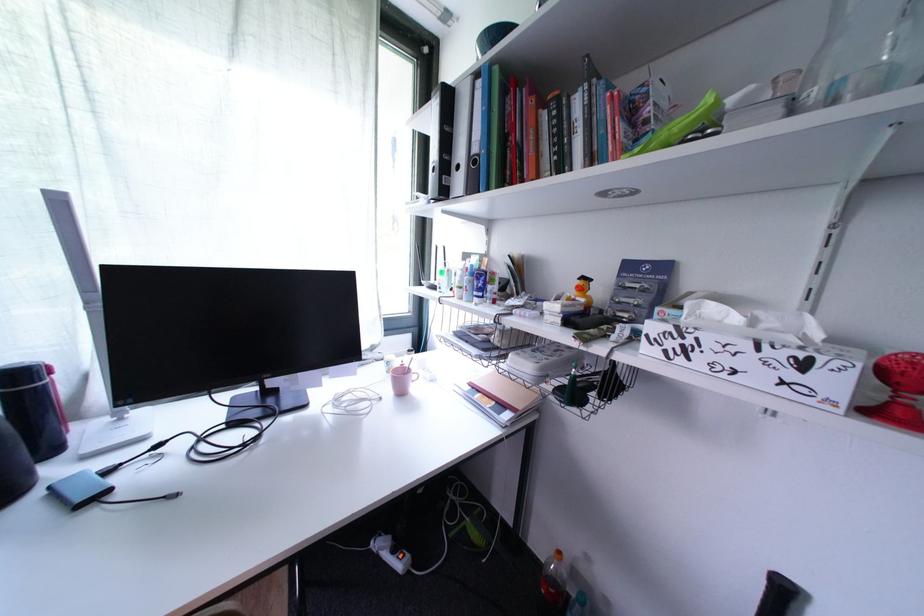
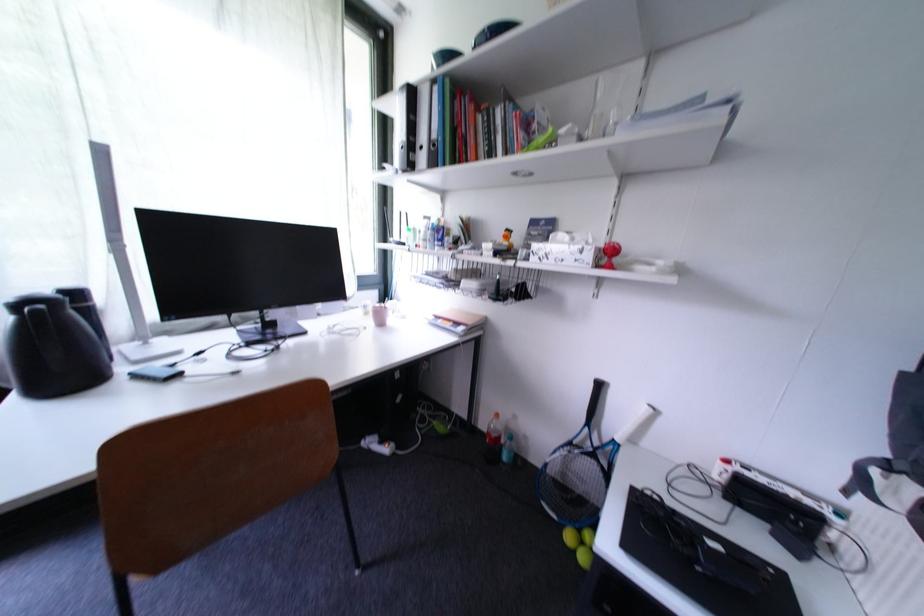
Where in the second image is the point corresponding to pixel 466 169 from the first image?

(430, 150)